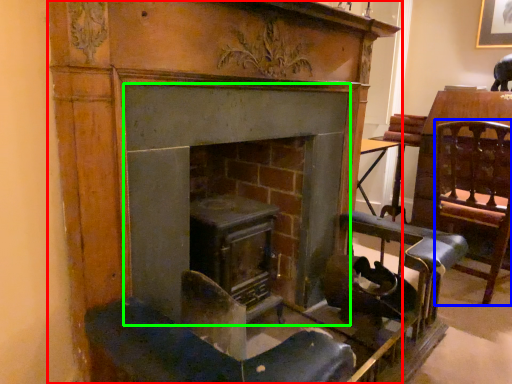
Question: Estimate the real-world distances between objects in this image. Which object is farther from fireplace (highlighted by a red box), swivel chair (highlighted by a blue box) or fireplace (highlighted by a green box)?

Choices:
 (A) swivel chair
 (B) fireplace

Answer: (A)